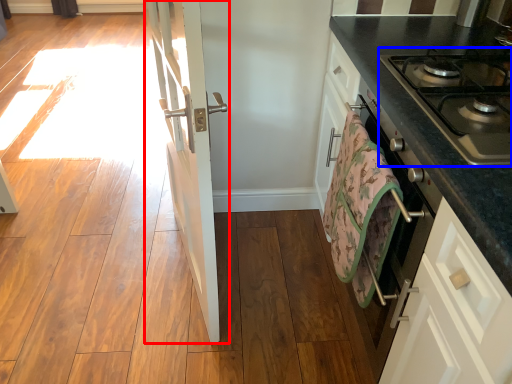
Question: Which of the following is the closest to the observer, door (highlighted by a red box) or gas stove (highlighted by a blue box)?

Choices:
 (A) door
 (B) gas stove

Answer: (B)